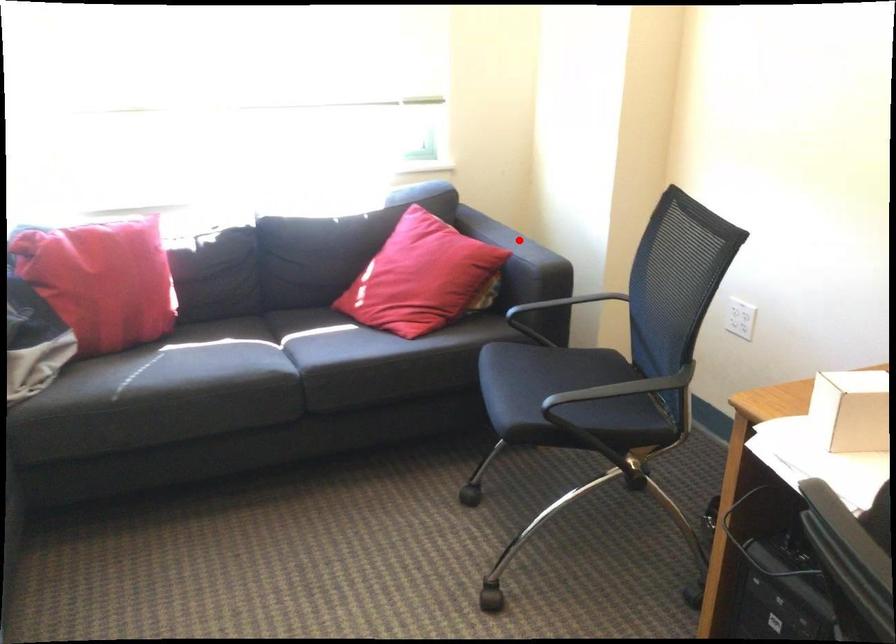
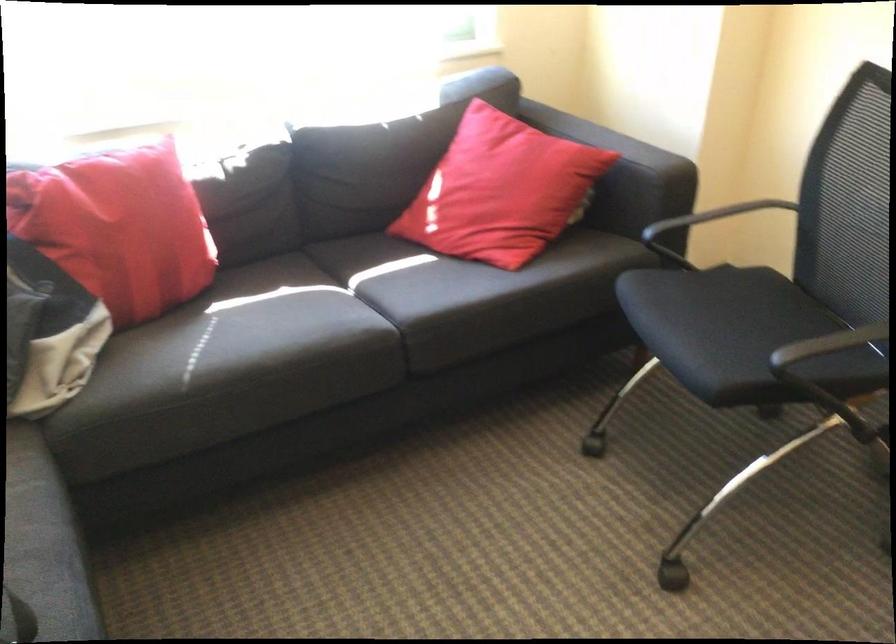
Question: I am providing you with two images of the same scene from different viewpoints. Image1 has a red point marked. In image2, the corresponding 3D location appears at what relative position? Reply with the corresponding letter.

Choices:
 (A) Closer
 (B) Farther

Answer: (A)